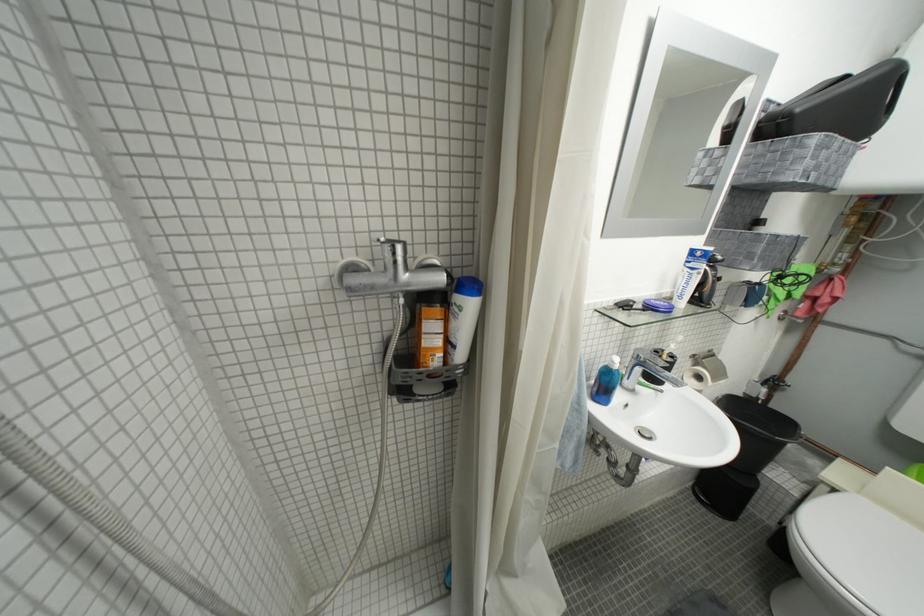
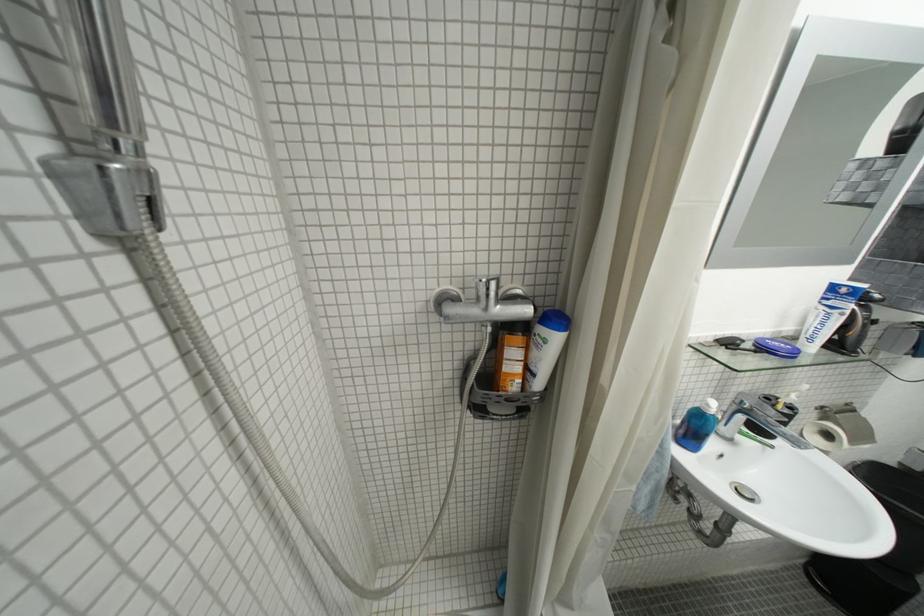
The point at (708, 379) is marked in the first image. Where is the corresponding point in the second image?

(836, 438)